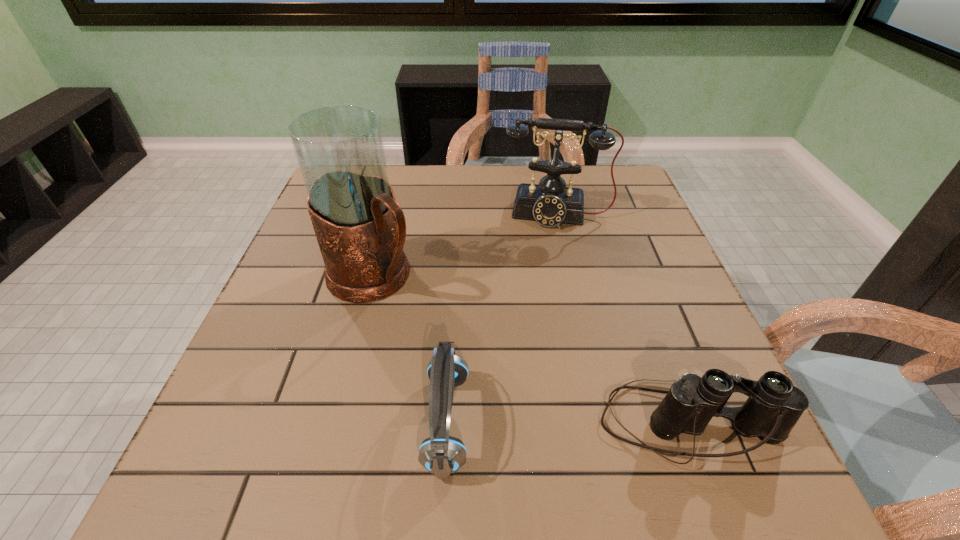
Identify the location of free space on the desktop that is between the third object from right to left and the binoculars and is positioned with the handle on the side of the third nearest object. (564, 422).

Locate an element on the screen. Image resolution: width=960 pixels, height=540 pixels. vacant space on the desktop that is between the second object from left to right and the binoculars and is positioned on the dial of the farthest object is located at coordinates (540, 422).